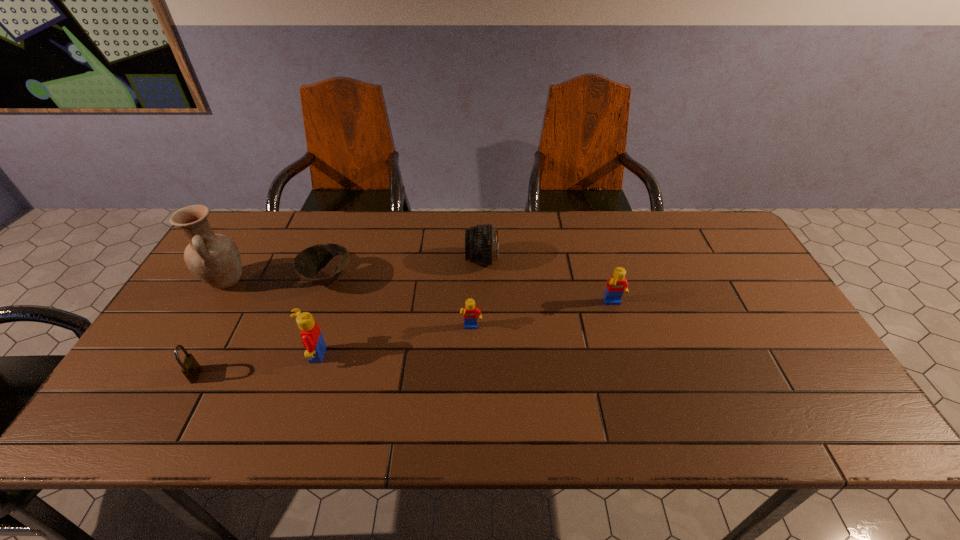
The height and width of the screenshot is (540, 960). I want to click on vacant space situated 0.070m on the back of the padlock, so [213, 343].

Image resolution: width=960 pixels, height=540 pixels. Identify the location of object present at the far edge. (481, 242).

You are a GUI agent. You are given a task and a screenshot of the screen. Output one action in this format:
    pyautogui.click(x=<x>, y=<y>)
    Task: Click on the Lego at the near edge
    Image resolution: width=960 pixels, height=540 pixels.
    Given the screenshot: What is the action you would take?
    pyautogui.click(x=311, y=335)

Locate an element on the screen. Image resolution: width=960 pixels, height=540 pixels. padlock located in the near edge section of the desktop is located at coordinates (190, 367).

Find the location of `pottery situated at the left edge`. pottery situated at the left edge is located at coordinates (215, 259).

Where is `padlock at the left edge`? This screenshot has height=540, width=960. padlock at the left edge is located at coordinates (190, 367).

I want to click on object at the near left corner, so click(190, 367).

You are a GUI agent. You are given a task and a screenshot of the screen. Output one action in this format:
    pyautogui.click(x=<x>, y=<y>)
    Task: Click on the vacant space at the far edge
    
    Given the screenshot: What is the action you would take?
    pyautogui.click(x=312, y=232)

Locate an element on the screen. The width and height of the screenshot is (960, 540). free space at the near edge of the desktop is located at coordinates (220, 395).

You are a GUI agent. You are given a task and a screenshot of the screen. Output one action in this format:
    pyautogui.click(x=<x>, y=<y>)
    Task: Click on the free space at the left edge of the desktop
    
    Given the screenshot: What is the action you would take?
    pyautogui.click(x=192, y=296)